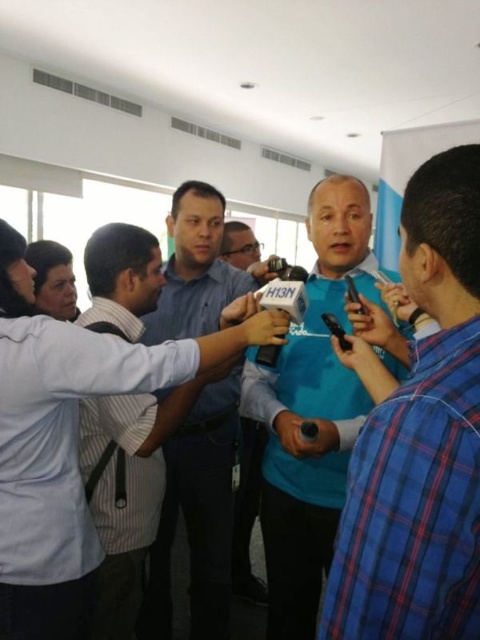
Does point (314, 547) lie in front of point (457, 184)?

That is False.

Find the location of a particular element. This screenshot has width=480, height=640. blue fabric shirt at center is located at coordinates (312, 412).

The width and height of the screenshot is (480, 640). What are the coordinates of `blue fabric shirt at center` in the screenshot? It's located at (312, 412).

At what (x,y) coordinates should I click in order to perform the action: click on blue fabric shirt at center. Please return your answer as a coordinate pair (x, y). Looking at the image, I should click on (312, 412).

Is blue fabric shirt at center wider than blue shirt at center?

Yes.

The width and height of the screenshot is (480, 640). Describe the element at coordinates (312, 412) in the screenshot. I see `blue fabric shirt at center` at that location.

Find the location of `blue fabric shirt at center`. blue fabric shirt at center is located at coordinates (312, 412).

Does light blue shirt at center have a lesser width compared to blue shirt at center?

Incorrect, light blue shirt at center's width is not less than blue shirt at center's.

At what (x,y) coordinates should I click in order to perform the action: click on light blue shirt at center. Please return your answer as a coordinate pair (x, y). This screenshot has width=480, height=640. Looking at the image, I should click on (68, 442).

You are a GUI agent. You are given a task and a screenshot of the screen. Output one action in this format:
    pyautogui.click(x=<x>, y=<y>)
    Task: Click on the light blue shirt at center
    
    Given the screenshot: What is the action you would take?
    pyautogui.click(x=68, y=442)

The image size is (480, 640). Find the location of `light blue shirt at center`. light blue shirt at center is located at coordinates (68, 442).